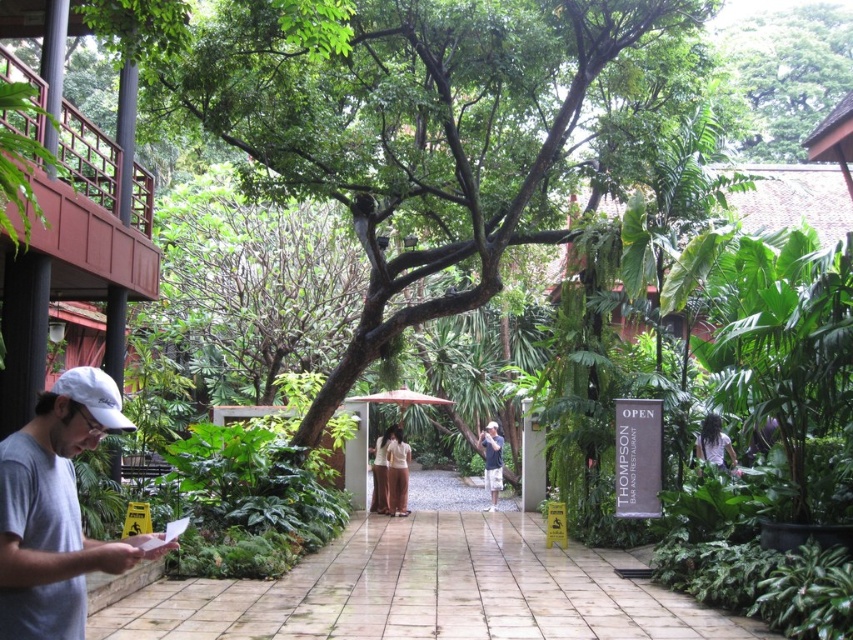
Does smooth stone path at center have a smaller size compared to light brown textured shorts at center?

Actually, smooth stone path at center might be larger than light brown textured shorts at center.

The image size is (853, 640). I want to click on smooth stone path at center, so click(428, 588).

This screenshot has width=853, height=640. Find the location of `smooth stone path at center`. smooth stone path at center is located at coordinates (428, 588).

Can you confirm if smooth stone path at center is positioned to the left of green leafy tree at upper right?

Indeed, smooth stone path at center is positioned on the left side of green leafy tree at upper right.

Locate an element on the screen. smooth stone path at center is located at coordinates (428, 588).

Between white matte baseball cap at left and light brown textured shorts at center, which one has more height?

With more height is light brown textured shorts at center.

Is point (67, 372) farther from camera compared to point (495, 429)?

No, it is in front of (495, 429).

Identify the location of white matte baseball cap at left. The image size is (853, 640). (94, 394).